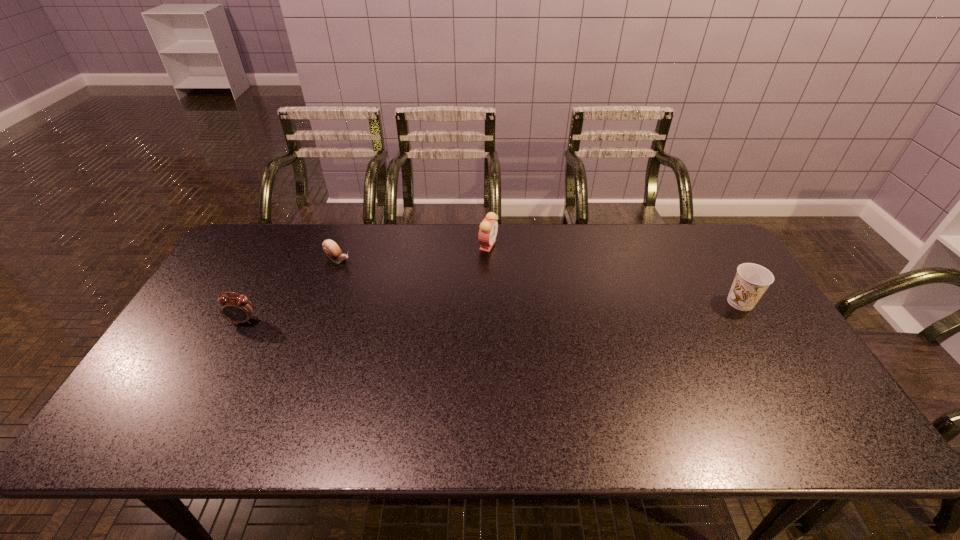
Where is `the nearest object`? Image resolution: width=960 pixels, height=540 pixels. the nearest object is located at coordinates pyautogui.click(x=238, y=309).

At what (x,y) coordinates should I click in order to perform the action: click on the left alarm clock. Please return your answer as a coordinate pair (x, y). This screenshot has width=960, height=540. Looking at the image, I should click on (238, 309).

This screenshot has width=960, height=540. I want to click on the rightmost object, so click(x=751, y=281).

Image resolution: width=960 pixels, height=540 pixels. Identify the location of Dixie cup. (751, 281).

At what (x,y) coordinates should I click in order to perform the action: click on the farther alarm clock. Please return your answer as a coordinate pair (x, y). The height and width of the screenshot is (540, 960). Looking at the image, I should click on [x=488, y=229].

The image size is (960, 540). Identify the location of the right alarm clock. (488, 229).

The width and height of the screenshot is (960, 540). What are the coordinates of `the second object from left to right` in the screenshot? It's located at (331, 249).

Find the location of a particular element. the shortest object is located at coordinates (331, 249).

The height and width of the screenshot is (540, 960). I want to click on vacant region located on the face of the left alarm clock, so click(198, 405).

Find the location of a particular element. This screenshot has width=960, height=540. vacant space located 0.330m on the back of the rightmost object is located at coordinates (694, 227).